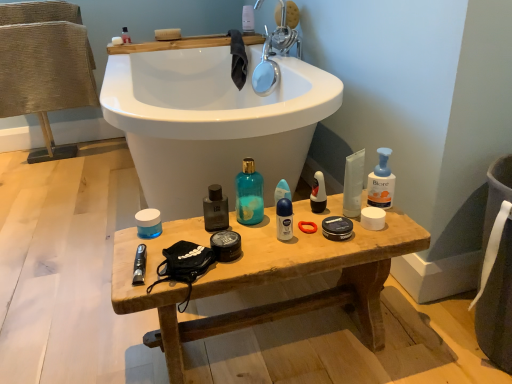
The image size is (512, 384). I want to click on vacant space situated above wooden bench at center (from a real-world perspective), so click(x=247, y=230).